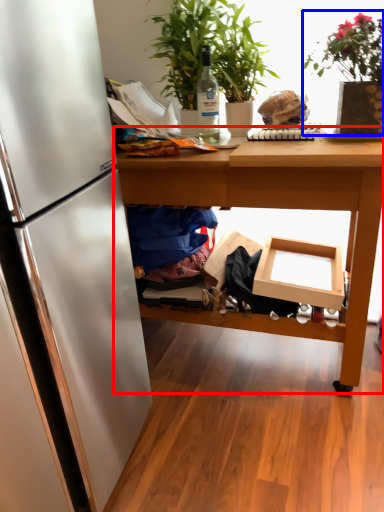
Question: Which of the following is the closest to the observer, table (highlighted by a red box) or houseplant (highlighted by a blue box)?

Choices:
 (A) table
 (B) houseplant

Answer: (B)